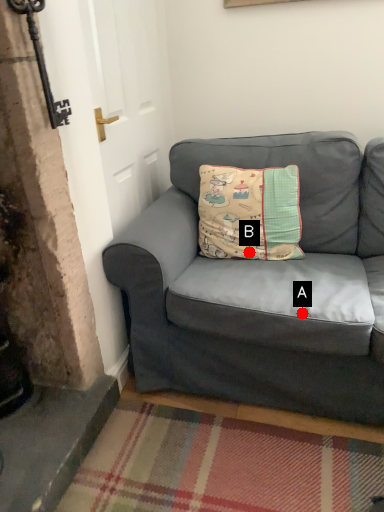
Question: Two points are circled on the image, labeled by A and B beside each circle. Which point is farther from the camera taking this photo?

Choices:
 (A) A is further
 (B) B is further

Answer: (B)